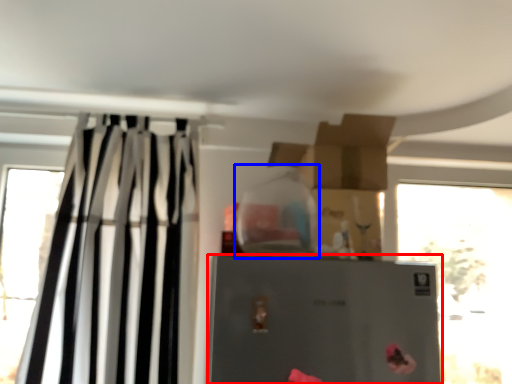
Question: Which point is further to the camera, refrigerator (highlighted by a red box) or bottle (highlighted by a blue box)?

Choices:
 (A) refrigerator
 (B) bottle

Answer: (B)